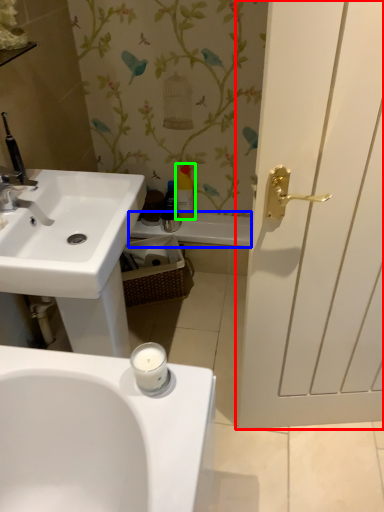
Question: Which object is the farthest from door (highlighted by a red box)? Choose among these: bath (highlighted by a blue box) or toiletry (highlighted by a green box).

Choices:
 (A) bath
 (B) toiletry

Answer: (B)